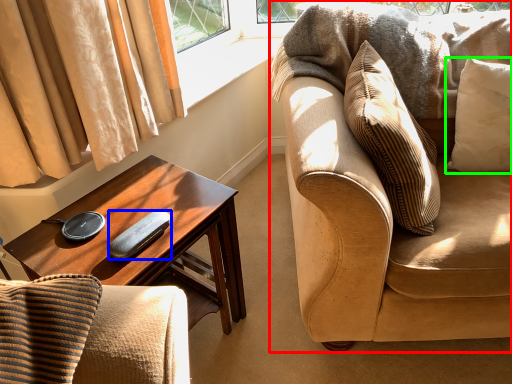
Question: Which object is positioned closest to studio couch (highlighted by a red box)? Select from remote control (highlighted by a blue box) and pillow (highlighted by a green box).

Choices:
 (A) remote control
 (B) pillow

Answer: (B)